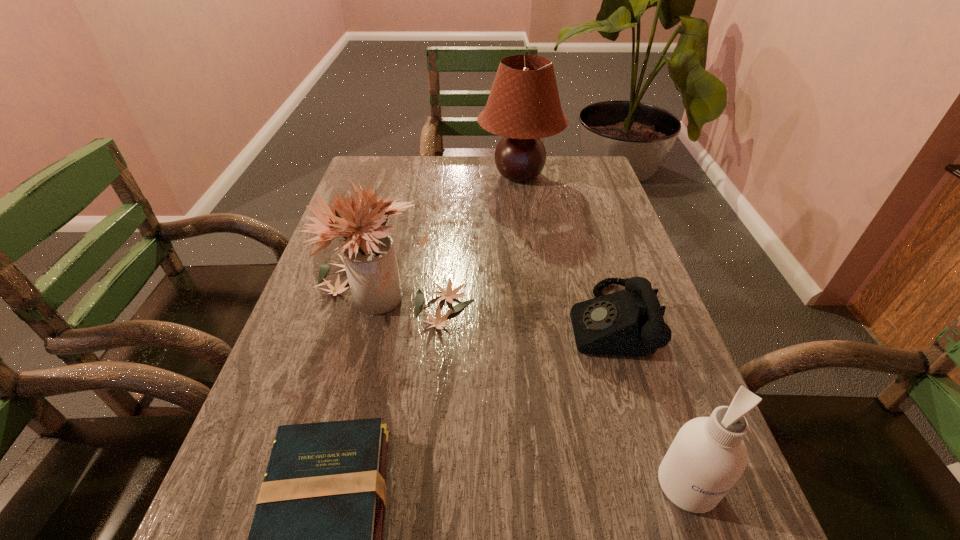
Where is `lampshade`? This screenshot has width=960, height=540. lampshade is located at coordinates (523, 106).

You are a GUI agent. You are given a task and a screenshot of the screen. Output one action in this format:
    pyautogui.click(x=<x>, y=<y>)
    Task: Click on the farthest object
    Image resolution: width=960 pixels, height=540 pixels.
    Given the screenshot: What is the action you would take?
    pyautogui.click(x=523, y=106)

Find the location of `bouquet`. bouquet is located at coordinates (369, 256).

Locate an element on the screen. This screenshot has height=540, width=960. the third tallest object is located at coordinates (708, 455).

You are a GUI agent. You are given a task and a screenshot of the screen. Output one action in this format:
    pyautogui.click(x=<x>, y=<y>)
    Task: Click on the telephone
    The height and width of the screenshot is (540, 960).
    Given the screenshot: What is the action you would take?
    pyautogui.click(x=630, y=322)

Locate an element on the screen. This screenshot has height=540, width=960. vacant area situated on the front-facing side of the lampshade is located at coordinates (445, 176).

The image size is (960, 540). I want to click on free space located 0.230m on the front-facing side of the lampshade, so click(x=411, y=176).

Locate an element on the screen. vacant space located 0.150m on the front-facing side of the lampshade is located at coordinates (434, 176).

Identify the location of vacant area situated on the right of the bouquet. This screenshot has width=960, height=540. (555, 293).

You are a GUI agent. You are given a task and a screenshot of the screen. Output one action in this format:
    pyautogui.click(x=<x>, y=<y>)
    Task: Click on the vacant space located on the dial of the fourth tallest object
    
    Given the screenshot: What is the action you would take?
    pyautogui.click(x=540, y=322)